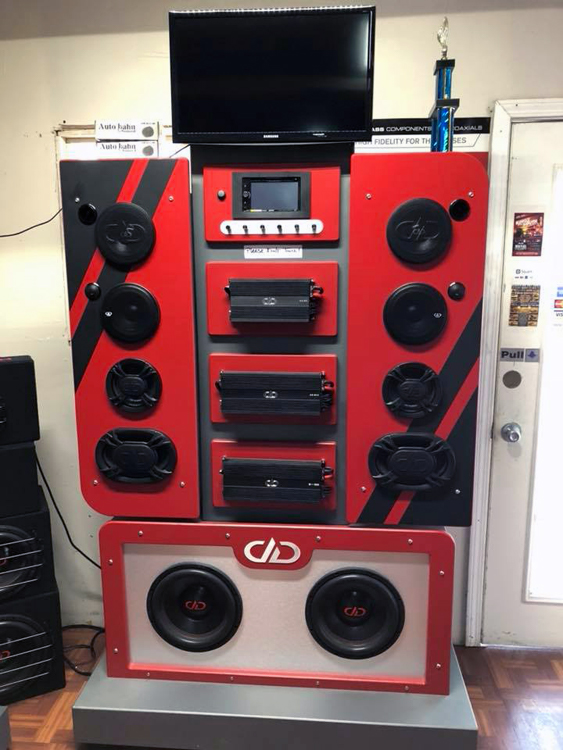
Where is `doorknob`? doorknob is located at coordinates (x=515, y=429).